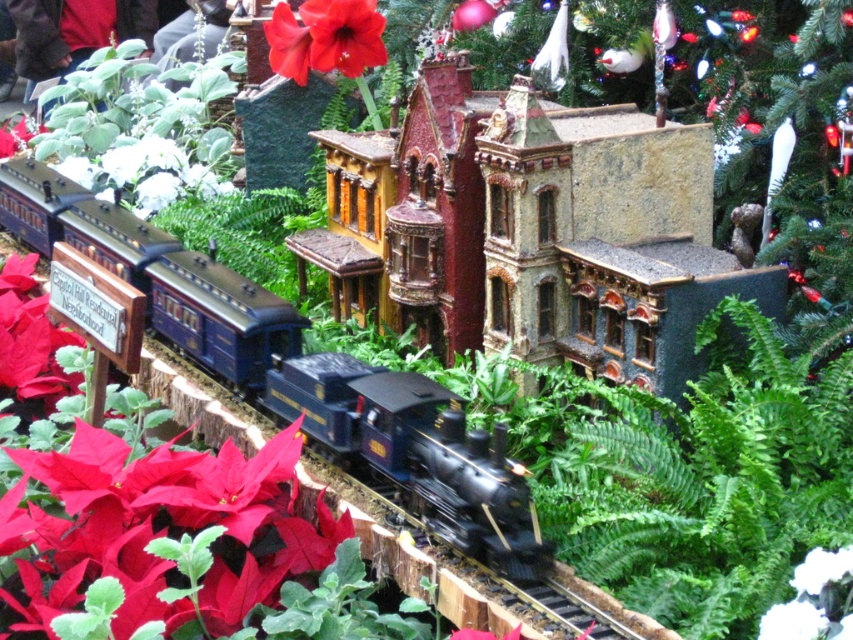
You are a toy engineer designing a new track for the shiny blue locomotive at center and the red matte poinsettia at upper center. Based on their current positions, which object is located to the right of the other?

The shiny blue locomotive at center is positioned on the left side of red matte poinsettia at upper center, so the red matte poinsettia at upper center is to the right of the shiny blue locomotive at center.